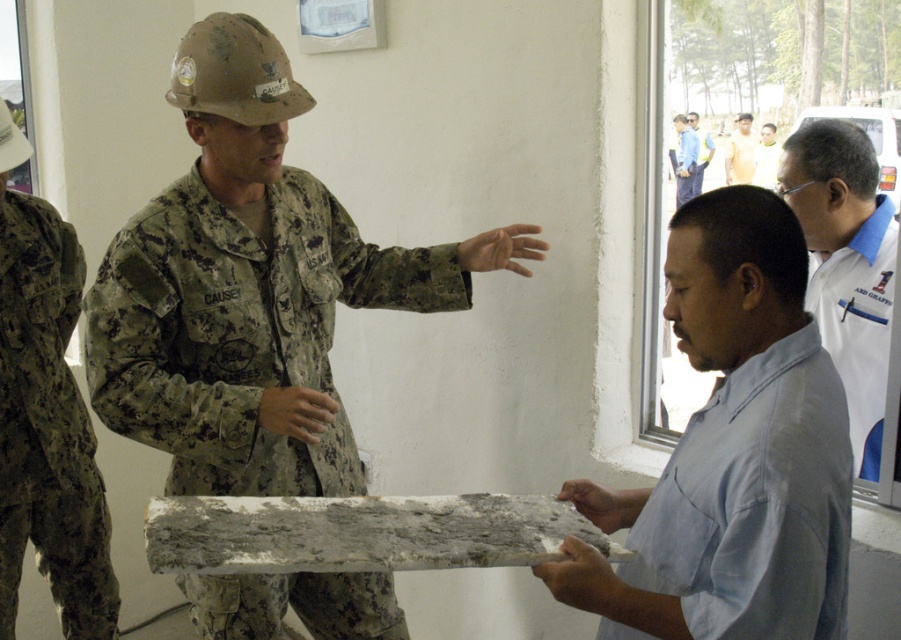
You are a security guard in the building and need to identify who is closer to the entrance located at the upper right corner. Based on the positions of the light brown skin at center and the white matte shirt at upper right, which individual is closer to the entrance?

The white matte shirt at upper right is behind light brown skin at center, so the light brown skin at center is closer to the entrance located at the upper right corner.

You are an observer standing in front of the scene. You notice the light brown skin at center and the white matte shirt at upper right. Which object is taller?

The light brown skin at center is taller than the white matte shirt at upper right according to the description provided.